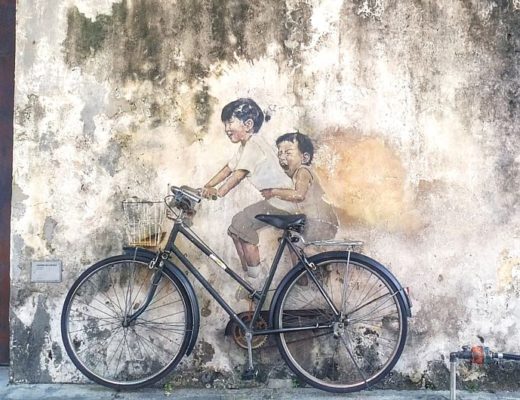
Find the location of a particular element. This screenshot has height=400, width=520. mural of children is located at coordinates (259, 165), (315, 191).